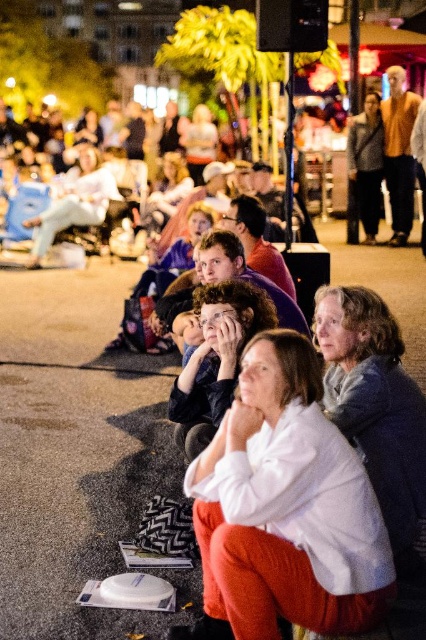
Does white cotton shirt at center appear on the right side of gray wool sweater at center?

No, white cotton shirt at center is not to the right of gray wool sweater at center.

Which is in front, point (193, 493) or point (331, 355)?

Point (193, 493)

Identify the location of white cotton shirt at center. This screenshot has width=426, height=640. coord(287,506).